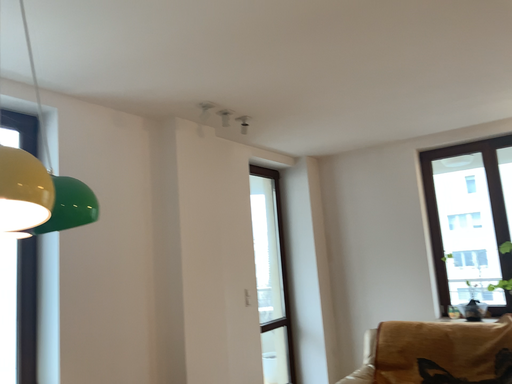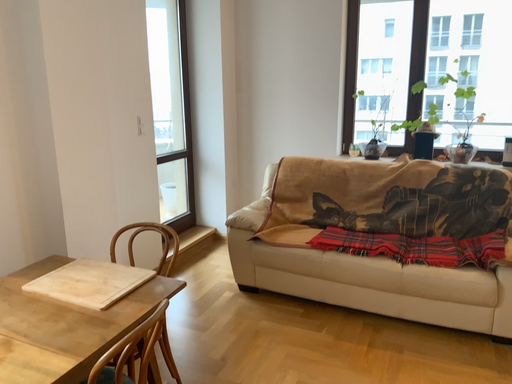
Question: How did the camera likely rotate when shooting the video?

Choices:
 (A) rotated downward
 (B) rotated upward

Answer: (A)